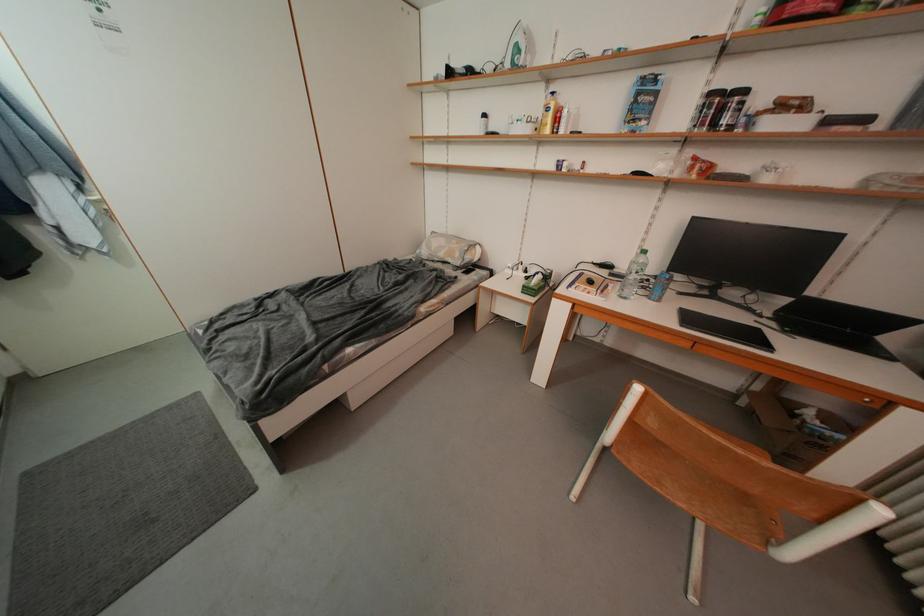
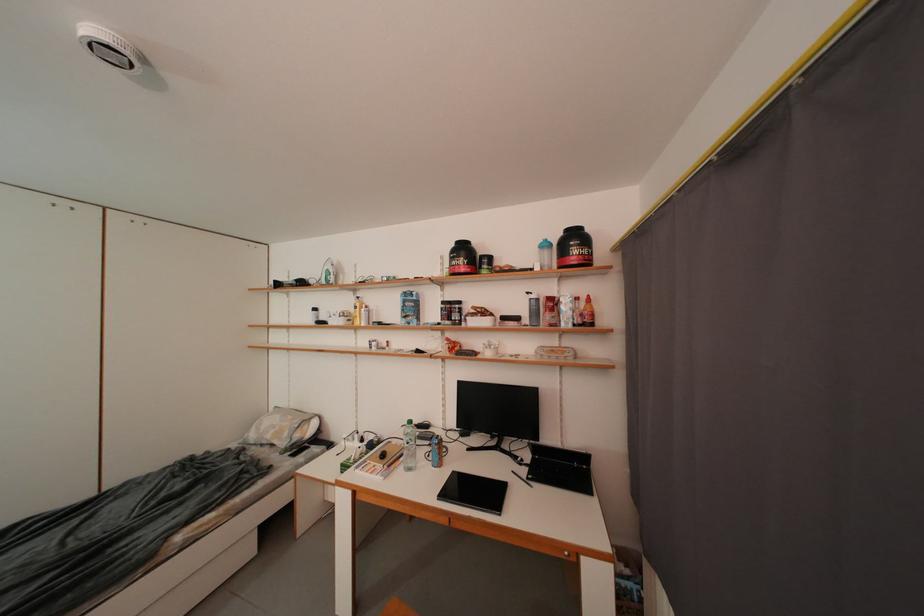
From the picture: Based on the continuous images, in which direction is the camera rotating?

The camera's rotation is toward right-up.